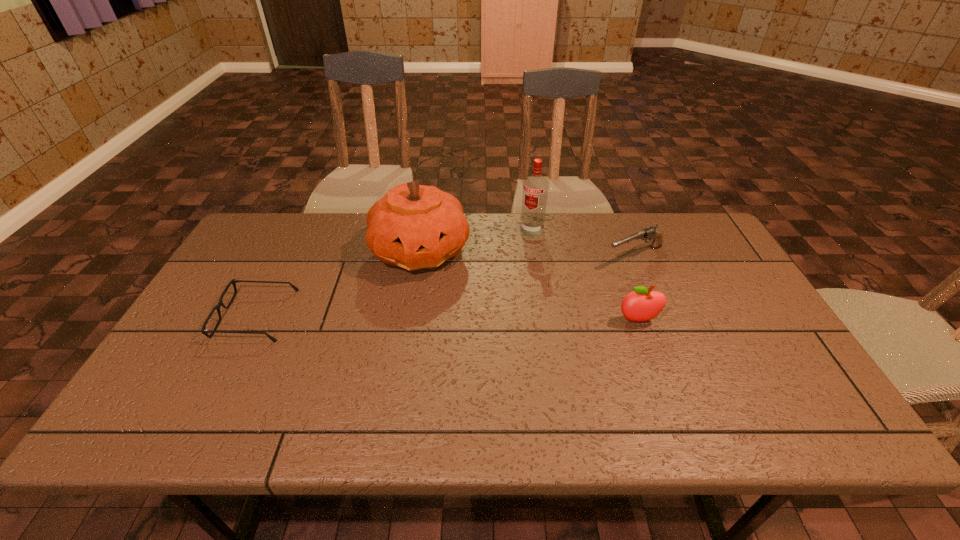
Find the location of a particular element. The height and width of the screenshot is (540, 960). blank region between the pumpkin and the third tallest object is located at coordinates (529, 286).

Where is `vacant area that lies between the second shortest object and the vodka`? vacant area that lies between the second shortest object and the vodka is located at coordinates (583, 243).

Where is `vacant region between the spectacles and the gun`? This screenshot has height=540, width=960. vacant region between the spectacles and the gun is located at coordinates (445, 286).

This screenshot has height=540, width=960. I want to click on blank region between the pumpkin and the shortest object, so click(x=338, y=283).

Identify the location of vacant area that lies between the gun and the fourth object from right to left. This screenshot has width=960, height=540. [x=528, y=253].

Select which object is the third closest to the leftmost object. Please provide its 2D coordinates. Your answer should be formatted as a tuple, i.e. [(x, y)], where the tuple contains the x and y coordinates of a point satisfying the conditions above.

[(644, 304)]

You are a GUI agent. You are given a task and a screenshot of the screen. Output one action in this format:
    pyautogui.click(x=<x>, y=<y>)
    Task: Click on the object that stands as the fourth closest to the shortest object
    
    Given the screenshot: What is the action you would take?
    pyautogui.click(x=650, y=233)

Image resolution: width=960 pixels, height=540 pixels. Identify the location of free location that satisfies the following two spatial constraints: 1. on the back side of the vodka; 2. on the right side of the second object from left to right. (423, 230).

Locate an element on the screen. The width and height of the screenshot is (960, 540). vacant space that satisfies the following two spatial constraints: 1. on the front side of the gun; 2. on the left side of the fourth object from right to left is located at coordinates (420, 256).

I want to click on free space in the image that satisfies the following two spatial constraints: 1. on the back side of the vodka; 2. on the left side of the fourth object from right to left, so click(x=423, y=230).